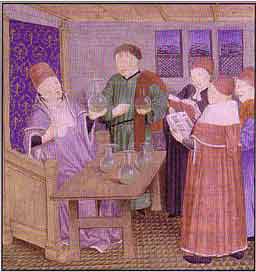
Identify the location of window. Image resolution: width=256 pixels, height=272 pixels. (172, 41), (201, 41), (230, 43).